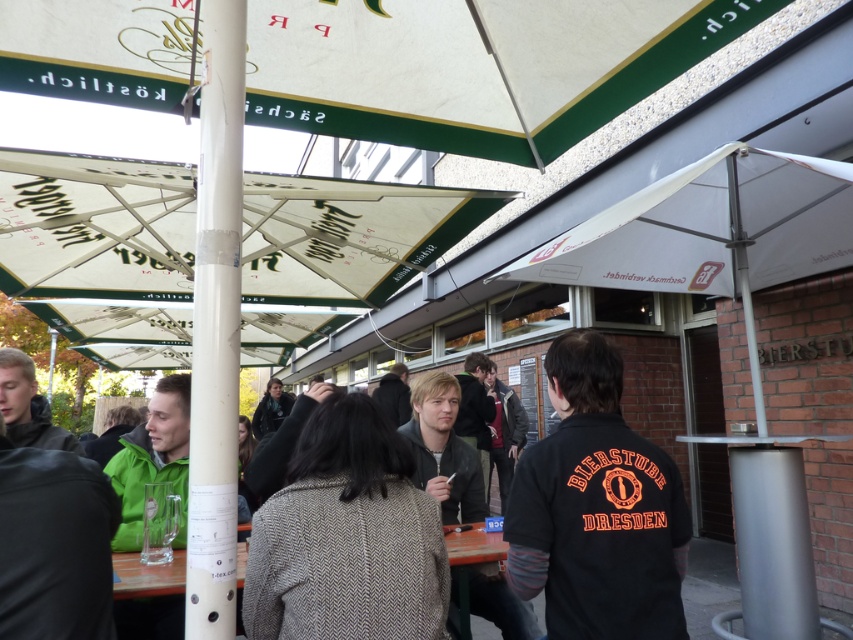
Question: Which point appears closest to the camera in this image?

Choices:
 (A) (396, 490)
 (B) (254, 433)

Answer: (A)

Question: Does clear glass table at center have a larger size compared to dark gray wool coat at center?

Choices:
 (A) yes
 (B) no

Answer: (B)

Question: Is brown herringbone coat at center below clear glass table at center?

Choices:
 (A) yes
 (B) no

Answer: (B)

Question: Which object is positioned closest to the dark gray jacket at left?

Choices:
 (A) dark gray wool coat at center
 (B) brown herringbone coat at center
 (C) black cotton shirt at center
 (D) white textured canopy at upper center

Answer: (B)

Question: Does clear glass table at center appear under dark gray wool coat at center?

Choices:
 (A) no
 (B) yes

Answer: (A)

Question: Which object appears farthest from the camera in this image?

Choices:
 (A) dark gray wool coat at center
 (B) black cotton shirt at center
 (C) clear glass table at center

Answer: (A)